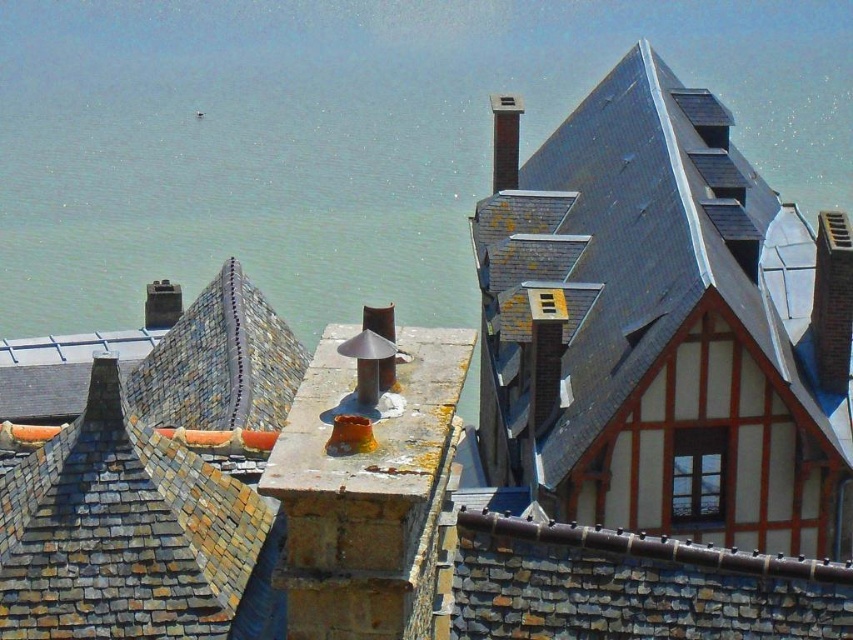
Question: Can you confirm if shiny slate roof at upper right is positioned above smooth silver chimney at upper center?

Choices:
 (A) no
 (B) yes

Answer: (A)

Question: Does shiny slate roof at upper right have a greater width compared to smooth silver chimney at upper center?

Choices:
 (A) no
 (B) yes

Answer: (B)

Question: Among these points, which one is nearest to the camera?

Choices:
 (A) (521, 104)
 (B) (625, 376)

Answer: (B)

Question: Does shiny slate roof at upper right appear over smooth silver chimney at upper center?

Choices:
 (A) no
 (B) yes

Answer: (A)

Question: Which point appears farthest from the camera in this image?

Choices:
 (A) (508, 109)
 (B) (553, 221)

Answer: (A)